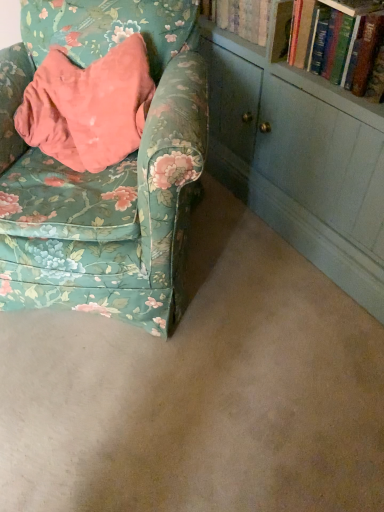
Locate an element on the screen. free space on the front side of floral fabric chair at left is located at coordinates (148, 404).